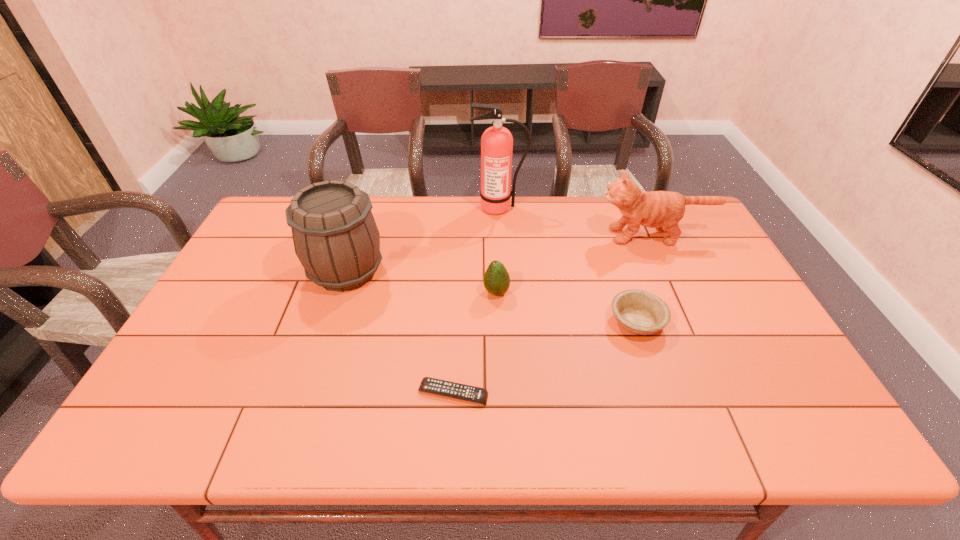
Locate an element on the screen. The width and height of the screenshot is (960, 540). object at the far right corner is located at coordinates (663, 210).

I want to click on free space at the far edge of the desktop, so click(x=568, y=207).

At what (x,y) coordinates should I click in order to perform the action: click on vacant region at the near edge. Please return your answer as a coordinate pair (x, y). The height and width of the screenshot is (540, 960). Looking at the image, I should click on (586, 427).

Where is `vacant space at the left edge of the desktop`? vacant space at the left edge of the desktop is located at coordinates (235, 269).

You are a GUI agent. You are given a task and a screenshot of the screen. Output one action in this format:
    pyautogui.click(x=<x>, y=<y>)
    Task: Click on the vacant region at the right edge of the desktop
    The height and width of the screenshot is (540, 960).
    Given the screenshot: What is the action you would take?
    pyautogui.click(x=764, y=376)

You are a GUI agent. You are given a task and a screenshot of the screen. Output one action in this format:
    pyautogui.click(x=<x>, y=<y>)
    Task: Click on the free space at the near left corner of the desktop
    The width and height of the screenshot is (960, 540).
    Given the screenshot: What is the action you would take?
    pyautogui.click(x=185, y=424)

At what (x,y) coordinates should I click in order to perform the action: click on free space between the leftmost object and the third shortest object. Please return your answer as a coordinate pair (x, y). Image resolution: width=960 pixels, height=540 pixels. Looking at the image, I should click on pyautogui.click(x=421, y=282).

Identify the location of blank region between the fifth tallest object and the cat. (645, 279).

The image size is (960, 540). In order to click on unoccupied position between the fire extinguisher and the remote control in this screenshot , I will do `click(476, 300)`.

In order to click on empty space that is in between the avocado and the cat in this screenshot , I will do `click(575, 264)`.